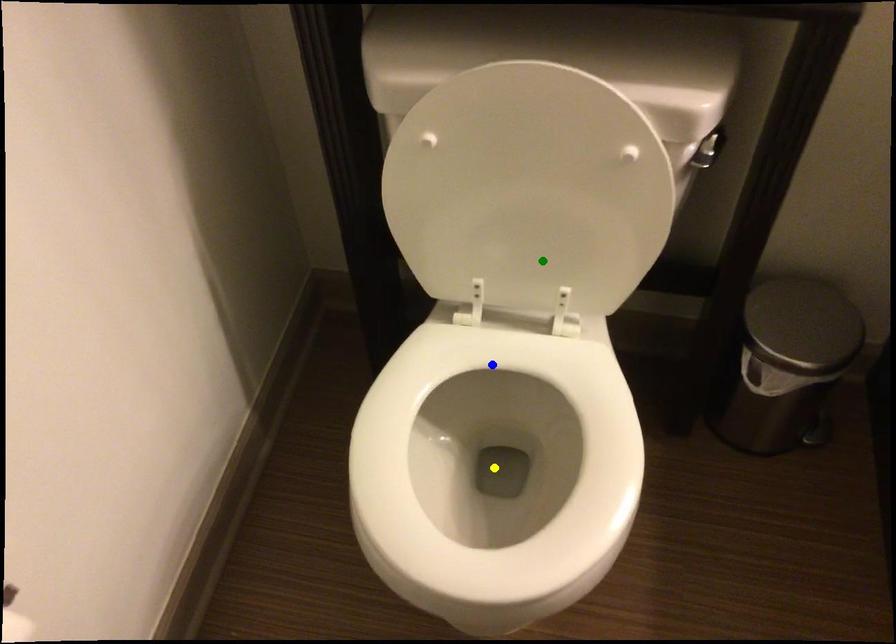
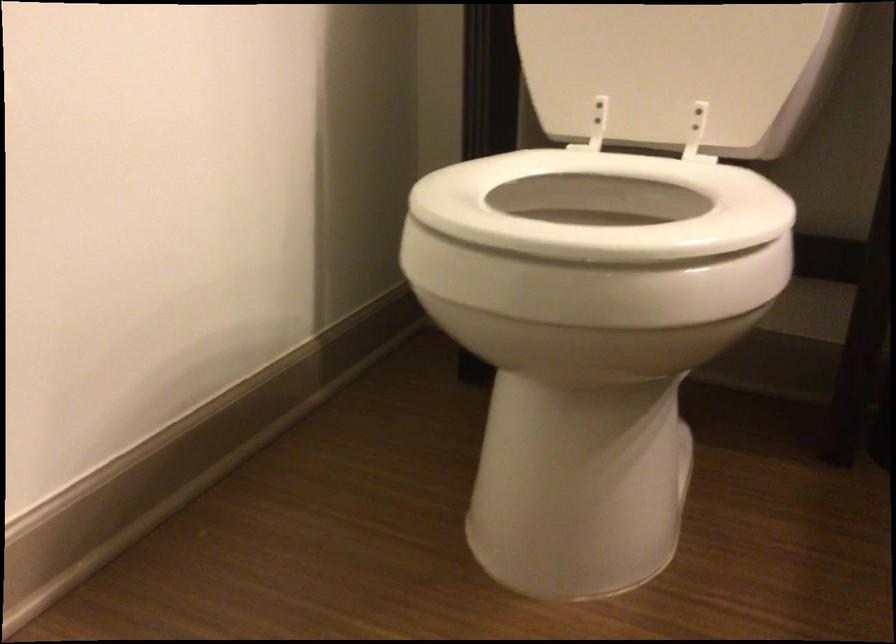
I am providing you with two images of the same scene from different viewpoints. Three points are marked in image1. Which point corresponds to a part or object that is occluded in image2?In image1, three points are marked. Which of them correspond to a part or object that is occluded in image2?Among the three points shown in image1, which one corresponds to a part or object that is no longer visible due to occlusion in image2?

Invisible in image2: yellow point.